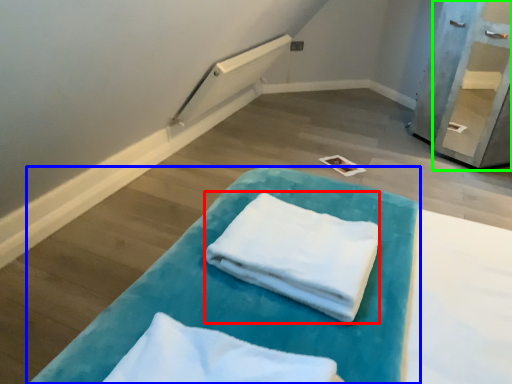
Question: Estimate the real-world distances between objects in this image. Which object is farther from cloth (highlighted by a red box), furniture (highlighted by a blue box) or shelf (highlighted by a green box)?

Choices:
 (A) furniture
 (B) shelf

Answer: (B)